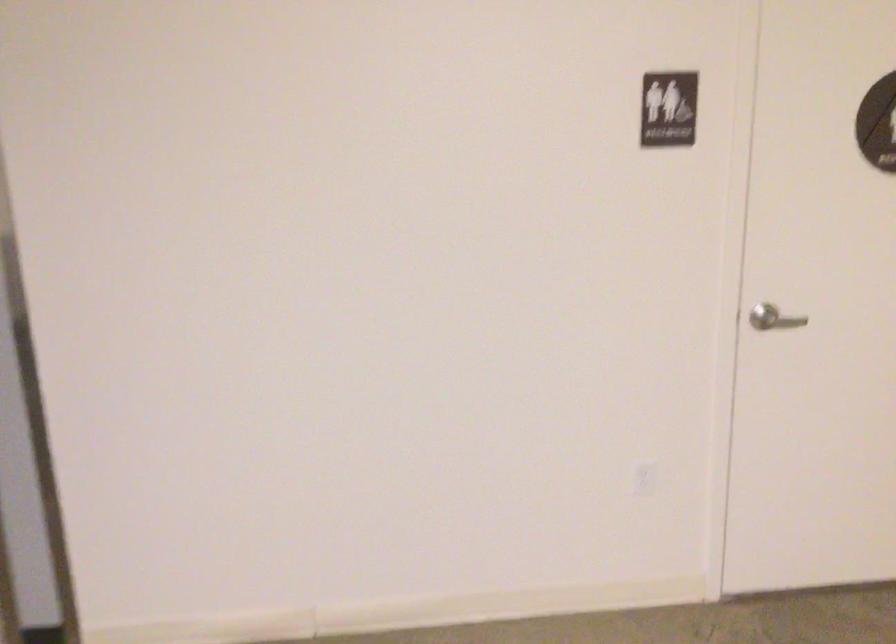
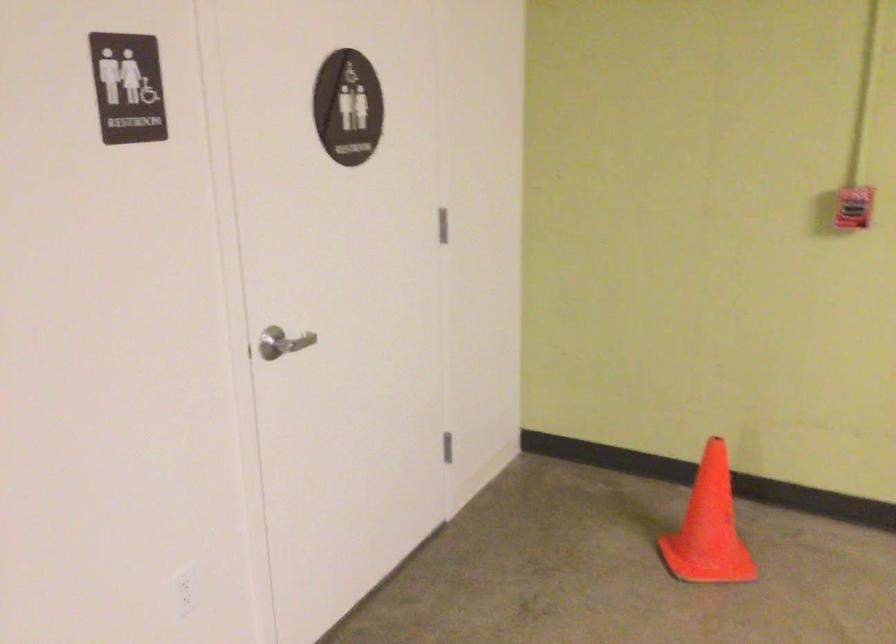
Find the pixel in the second image that matches [768,319] in the first image.

(281, 343)